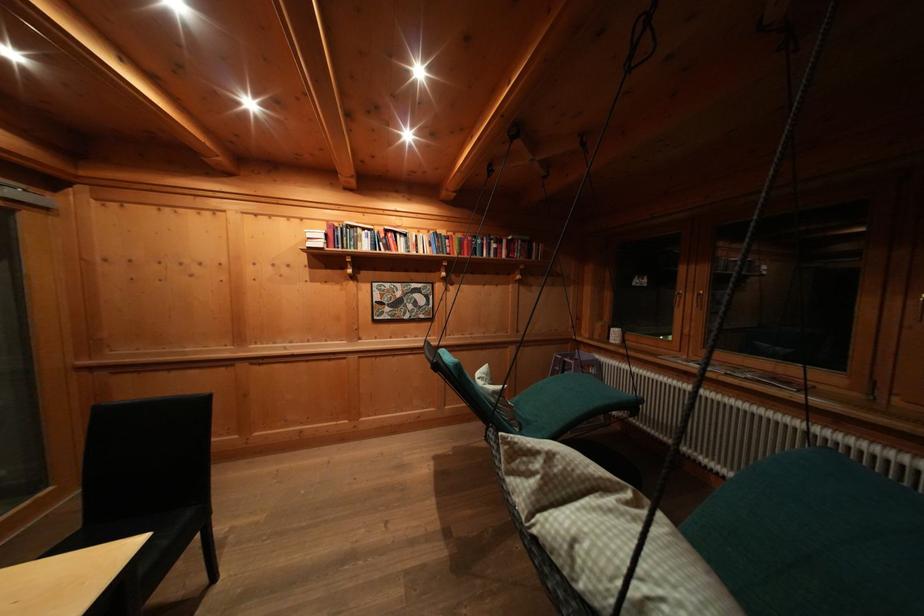
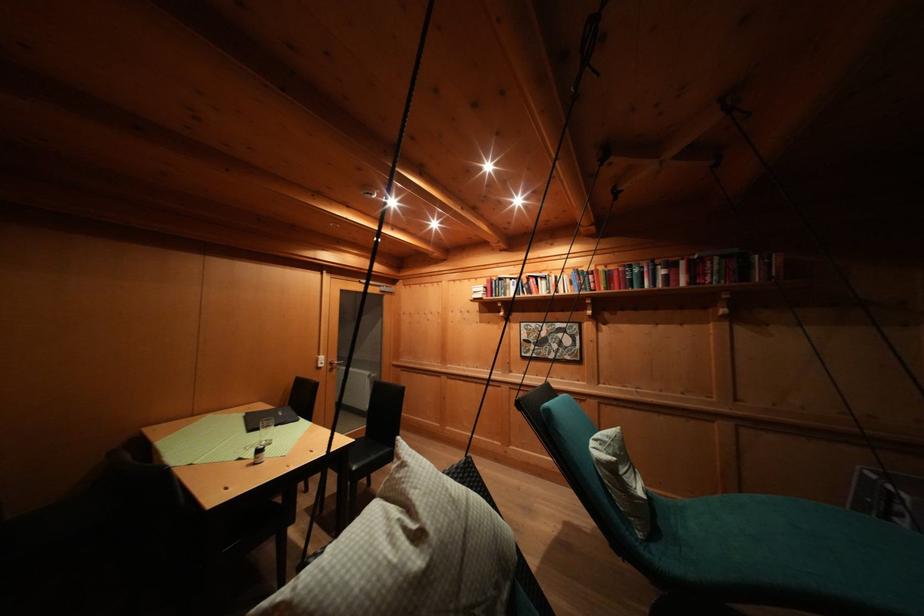
In the second image, find the point that corresponds to point (640, 525) in the first image.

(396, 541)